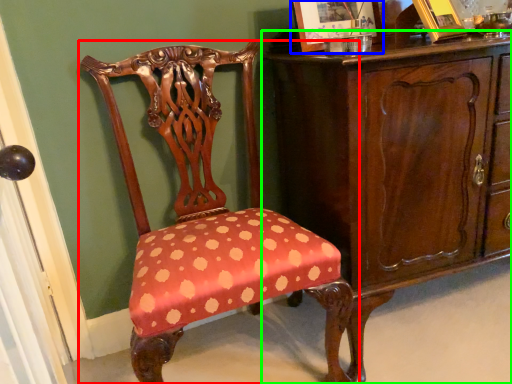
Question: Estimate the real-world distances between objects in this image. Which object is farther from chair (highlighted by a red box), picture frame (highlighted by a blue box) or chest of drawers (highlighted by a green box)?

Choices:
 (A) picture frame
 (B) chest of drawers

Answer: (A)